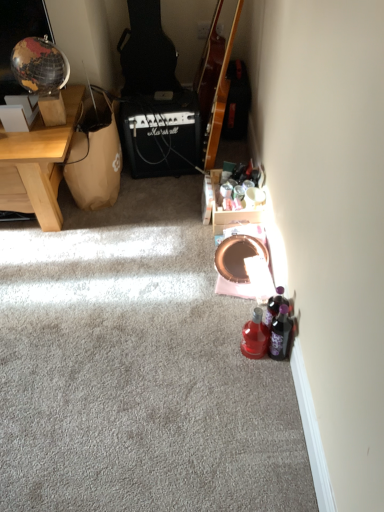
Question: Considering the positions of brown paper bag at left and black matte marshall amplifier at center in the image, is brown paper bag at left bigger or smaller than black matte marshall amplifier at center?

Choices:
 (A) small
 (B) big

Answer: (B)

Question: Does point (105, 148) appear closer or farther from the camera than point (160, 129)?

Choices:
 (A) closer
 (B) farther

Answer: (A)

Question: Which is nearer to the purple matte bottle at lower right, marked as the third bottle in a left-to-right arrangement?

Choices:
 (A) white cardboard box at upper left
 (B) translucent purple bottle at lower right, which is the 2th bottle in right-to-left order
 (C) black matte marshall amplifier at center
 (D) wooden desk at left
 (E) glossy wood guitar at upper center

Answer: (B)

Question: Estimate the real-world distances between objects in this image. Which object is farther from the black matte marshall amplifier at center?

Choices:
 (A) translucent purple bottle at lower right, marked as the 2th bottle in a left-to-right arrangement
 (B) white cardboard box at upper left
 (C) glossy wood guitar at upper center
 (D) purple matte bottle at lower right, marked as the 1th bottle in a right-to-left arrangement
 (E) translucent plastic bottle at lower right, acting as the third bottle starting from the right

Answer: (D)